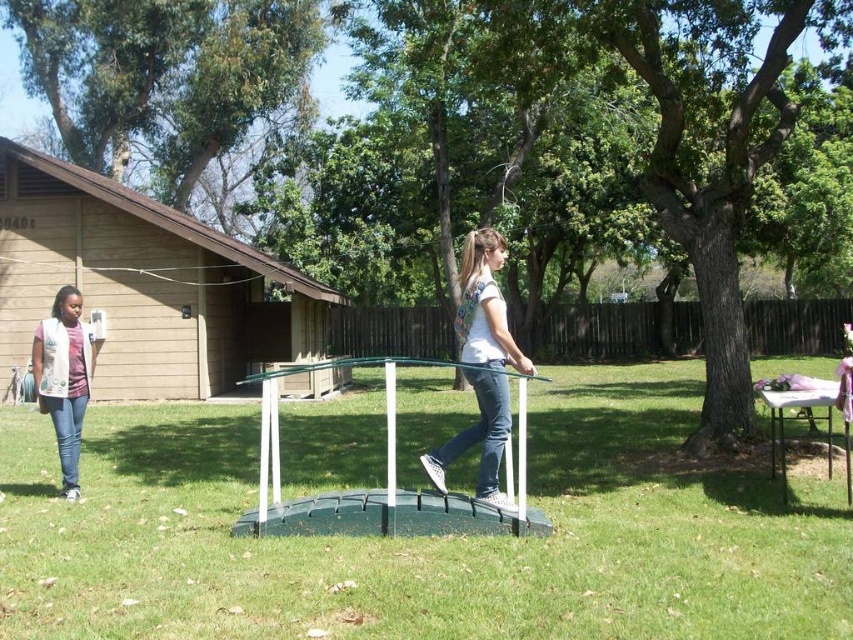
You are standing in the backyard and want to jump on the green plastic trampoline at center. However, there is a person wearing denim jeans at left nearby. Based on their positions, which direction should you move to reach the trampoline without getting too close to the person?

The green plastic trampoline at center is to the right of denim jeans at left. To reach the trampoline without getting too close to the person in denim jeans at left, you should move to the right side of the denim jeans at left.

You are planning to place a new garden bench in the backyard. The bench is 1.2 meters wide. The green plastic trampoline at center and the white matte shirt at center are in the way. Which object should you move to the right to make space for the bench?

You should move the green plastic trampoline at center to the right because it is currently to the left of the white matte shirt at center, so shifting it right would create space for the bench.

You are a drone operator trying to capture a photo of the green plastic trampoline at center from above. According to the image coordinates, where should you position the drone to ensure the trampoline is centered in the photo?

The green plastic trampoline at center is located at coordinates point [427,538], so you should position the drone directly above that point to center it in the photo.